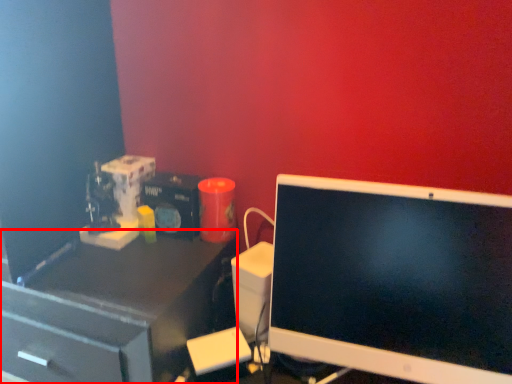
Question: From the image's perspective, considering the relative positions of desk (annotated by the red box) and computer monitor in the image provided, where is desk (annotated by the red box) located with respect to the staircase?

Choices:
 (A) above
 (B) below

Answer: (B)